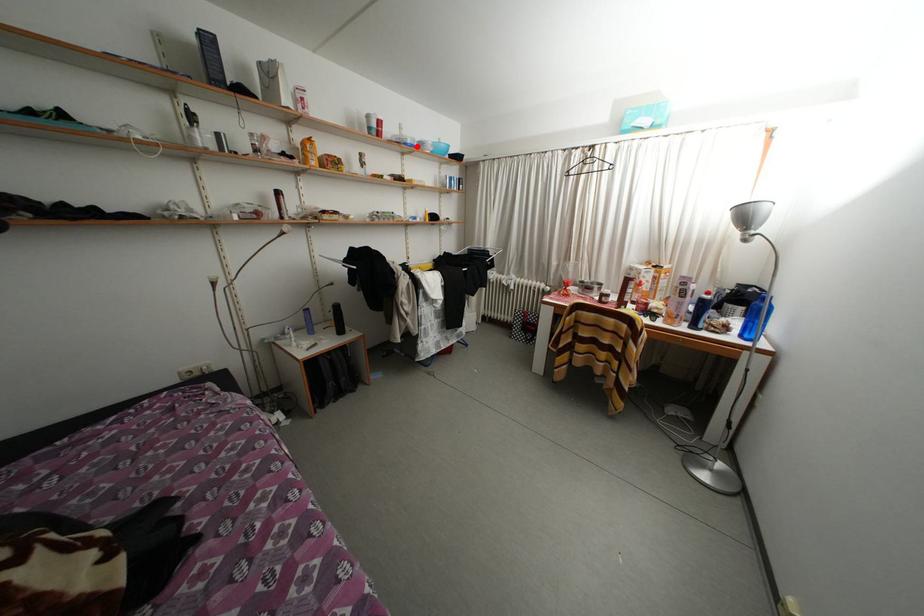
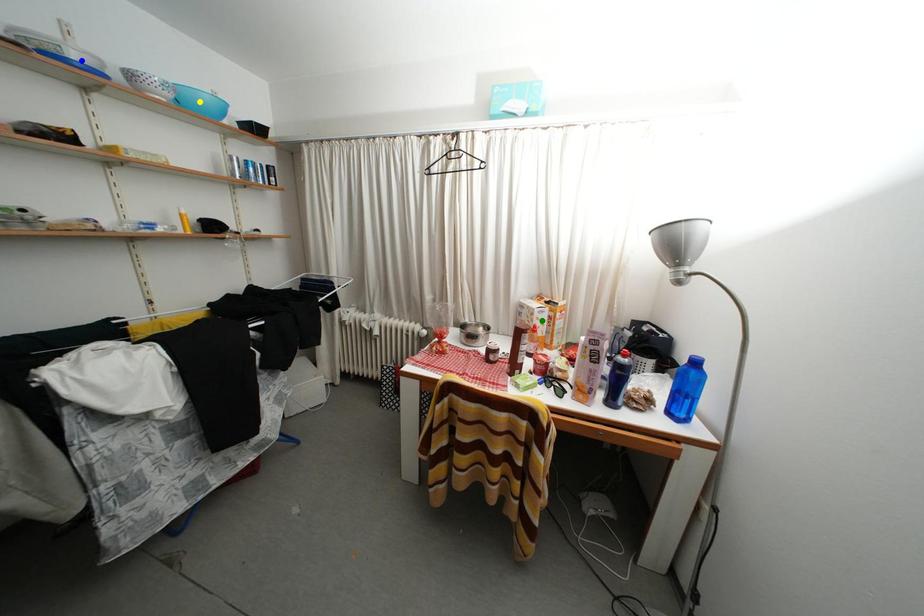
Question: I am providing you with two images of the same scene from different viewpoints. A red point is marked on the first image. You are given multiple points on the second image. Can you choose the point in image 2 that corresponds to the point in image 1?

Choices:
 (A) yellow point
 (B) blue point
 (C) green point

Answer: (B)